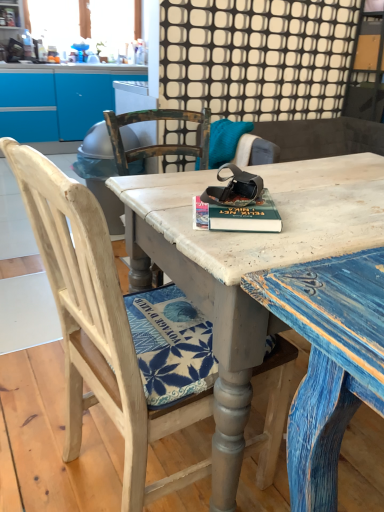
Question: Is hardcover book at center to the left or to the right of distressed wood desk at center in the image?

Choices:
 (A) left
 (B) right

Answer: (A)

Question: Considering the positions of hardcover book at center and distressed wood desk at center in the image, is hardcover book at center wider or thinner than distressed wood desk at center?

Choices:
 (A) wide
 (B) thin

Answer: (B)

Question: Estimate the real-world distances between objects in this image. Which object is closer to the wooden chair at center?

Choices:
 (A) distressed wood desk at center
 (B) hardcover book at center

Answer: (A)

Question: Considering the real-world distances, which object is farthest from the hardcover book at center?

Choices:
 (A) wooden chair at center
 (B) distressed wood desk at center

Answer: (A)